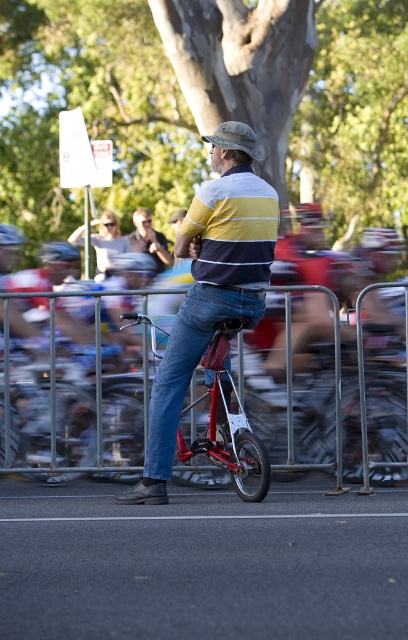
Question: Does matte yellow and blue striped shirt at center have a smaller size compared to matte black sunglasses at upper center?

Choices:
 (A) yes
 (B) no

Answer: (A)

Question: Which of the following is the farthest from the observer?

Choices:
 (A) (142, 376)
 (B) (148, 241)
 (C) (195, 241)

Answer: (B)

Question: Among these objects, which one is farthest from the camera?

Choices:
 (A) metallic silver fence at center
 (B) matte black camera at center
 (C) matte black sunglasses at upper center

Answer: (B)

Question: Which point is farther to the camera?

Choices:
 (A) matte black sunglasses at upper center
 (B) metallic silver fence at center
 (C) matte black camera at center

Answer: (C)

Question: Does metallic silver fence at center appear under matte black camera at center?

Choices:
 (A) no
 (B) yes

Answer: (B)

Question: Is matte yellow and blue striped shirt at center wider than matte black sunglasses at upper center?

Choices:
 (A) no
 (B) yes

Answer: (A)